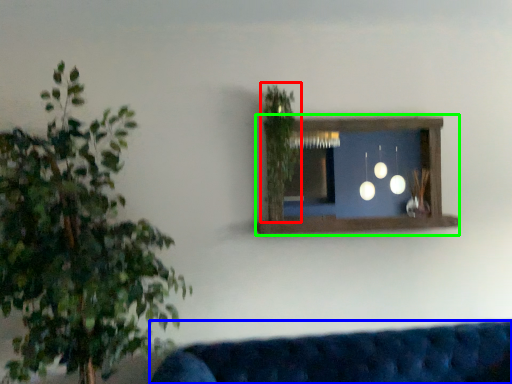
Question: Which object is the farthest from plant (highlighted by a red box)? Choose among these: studio couch (highlighted by a blue box) or window frame (highlighted by a green box).

Choices:
 (A) studio couch
 (B) window frame

Answer: (A)